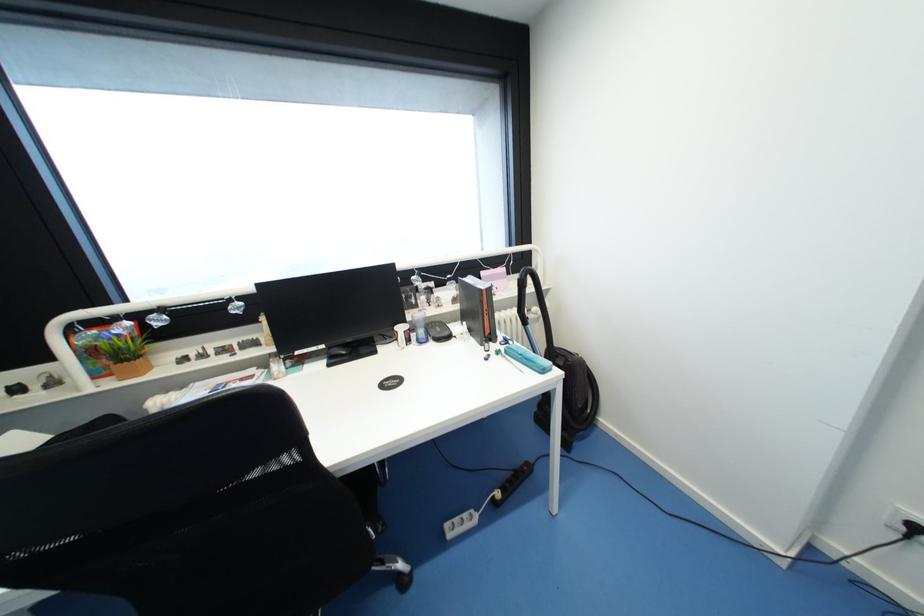
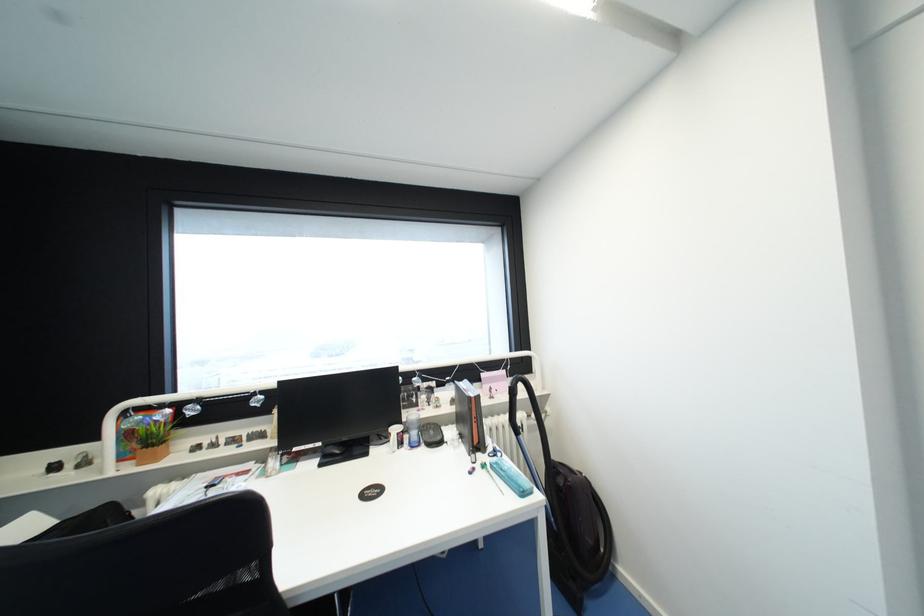
Where in the second image is the point corresponding to point (132, 323) from the first image?

(174, 411)